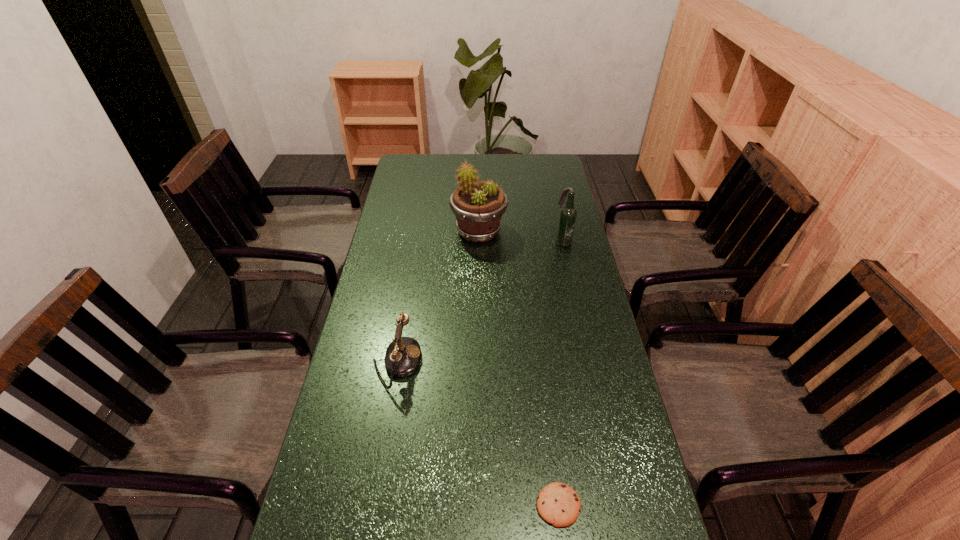
You are a GUI agent. You are given a task and a screenshot of the screen. Output one action in this format:
    pyautogui.click(x=<x>, y=<y>)
    Task: Click on the vacant space that satisfies the following two spatial constraints: 1. on the front side of the beer bottle; 2. on the left side of the flowerpot
    Image resolution: width=960 pixels, height=540 pixels.
    Given the screenshot: What is the action you would take?
    tap(479, 241)

Locate an element on the screen. vacant space that satisfies the following two spatial constraints: 1. on the back side of the shortest object; 2. on the right side of the beer bottle is located at coordinates (526, 241).

This screenshot has height=540, width=960. What are the coordinates of `vacant space that satisfies the following two spatial constraints: 1. on the front side of the second tallest object; 2. on the dial of the telephone` in the screenshot? It's located at 589,363.

This screenshot has height=540, width=960. I want to click on free location that satisfies the following two spatial constraints: 1. on the back side of the cookie; 2. on the dial of the second shortest object, so click(x=540, y=363).

Find the location of `free space that satisfies the following two spatial constraints: 1. on the front side of the tallest object; 2. on the left side of the cookie`. free space that satisfies the following two spatial constraints: 1. on the front side of the tallest object; 2. on the left side of the cookie is located at coordinates (478, 505).

Locate an element on the screen. This screenshot has height=540, width=960. vacant space that satisfies the following two spatial constraints: 1. on the dial of the third farthest object; 2. on the right side of the shortest object is located at coordinates (372, 505).